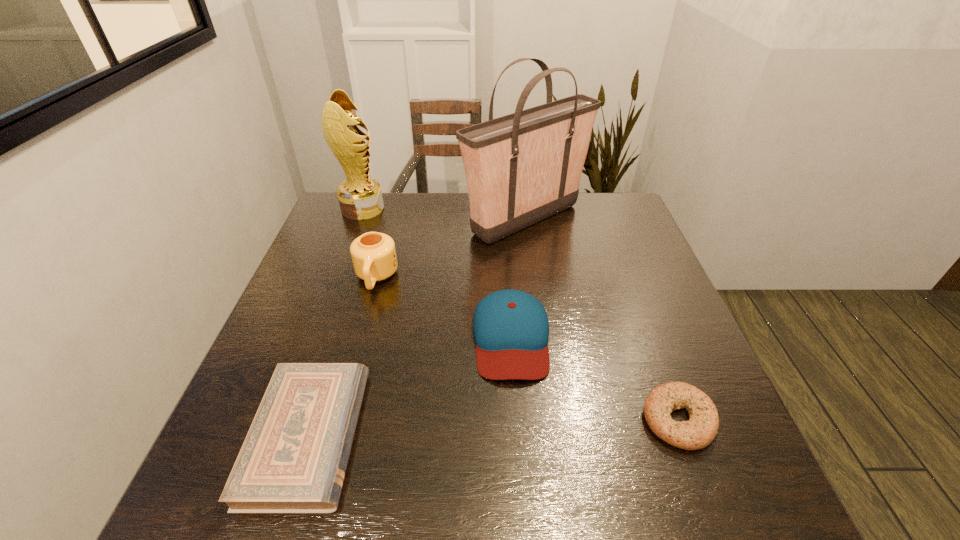
Locate an element on the screen. The height and width of the screenshot is (540, 960). the tallest object is located at coordinates (522, 168).

Where is `award`? This screenshot has height=540, width=960. award is located at coordinates (360, 197).

Where is `mug`? mug is located at coordinates (373, 254).

Where is `the third farthest object`? Image resolution: width=960 pixels, height=540 pixels. the third farthest object is located at coordinates (373, 254).

In order to click on baseball cap in this screenshot , I will do `click(511, 329)`.

This screenshot has width=960, height=540. I want to click on bagel, so click(697, 433).

You are a GUI agent. You are given a task and a screenshot of the screen. Output one action in this format:
    pyautogui.click(x=<x>, y=<y>)
    Task: Click on the Bible
    The height and width of the screenshot is (540, 960).
    Given the screenshot: What is the action you would take?
    pyautogui.click(x=293, y=460)

Identify the location of free space located 0.170m on the front of the tallest object. (536, 293).

What are the coordinates of `free region located 0.130m on the front-facing side of the second tallest object` in the screenshot? It's located at (424, 209).

What are the coordinates of `vacant region located 0.340m on the handle side of the mug` in the screenshot? It's located at (338, 420).